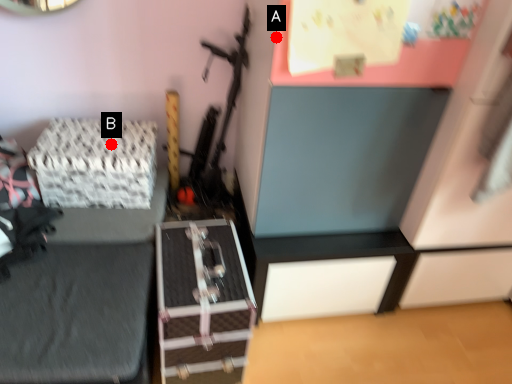
Question: Two points are circled on the image, labeled by A and B beside each circle. Which point appears farthest from the camera in this image?

Choices:
 (A) A is further
 (B) B is further

Answer: (B)